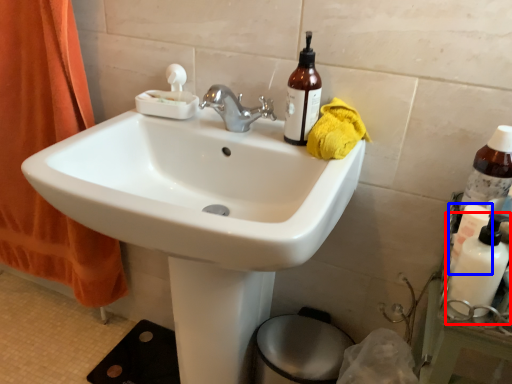
Question: Which of the following is the closest to the observer, cleaning product (highlighted by a red box) or toiletry (highlighted by a blue box)?

Choices:
 (A) cleaning product
 (B) toiletry

Answer: (A)